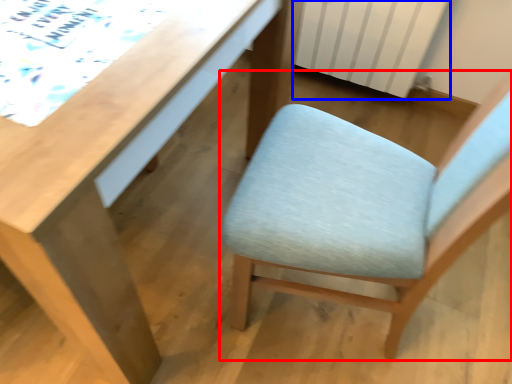
Question: Among these objects, which one is nearest to the camera, chair (highlighted by a red box) or radiator (highlighted by a blue box)?

Choices:
 (A) chair
 (B) radiator

Answer: (A)